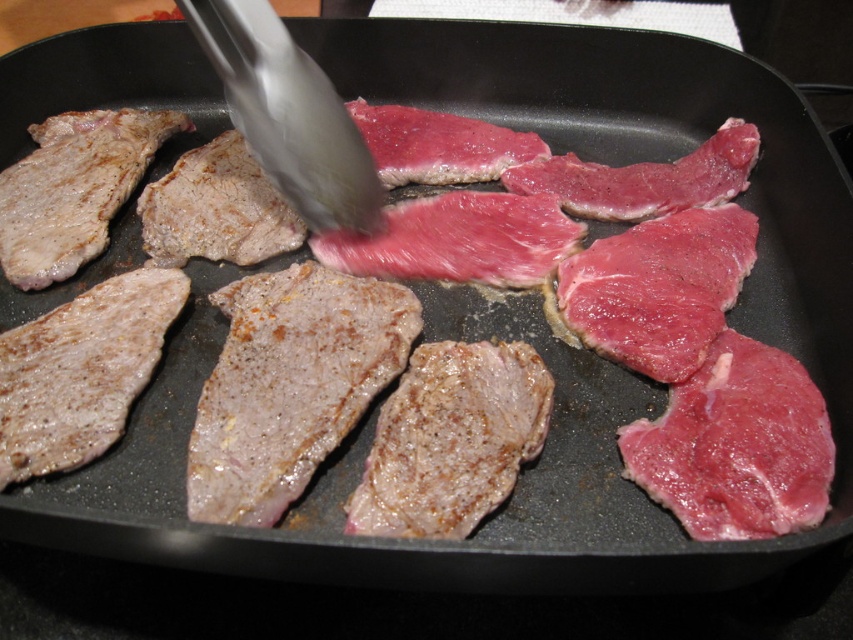
You are a chef trying to flip the pink raw meat at center with the silver metallic tong at center. Can you fit the meat into the tong?

The pink raw meat at center is smaller than the silver metallic tong at center, so the meat may not fit properly in the tong. You might need to adjust your grip or use a different tool.

You are a chef trying to flip the lamb chop closest to you in the frying pan. The two points you see are point (x=744, y=467) and point (x=238, y=33). Which point should you aim for to flip the closest lamb chop?

Point (x=744, y=467) is closer to the viewer than point (x=238, y=33), so you should aim for point (x=744, y=467) to flip the closest lamb chop.

You are a chef trying to flip the pink raw meat at center using the silver metallic tong at center. Can you reach the meat with the tongs?

The pink raw meat at center is shorter than the silver metallic tong at center, so yes, the chef can reach the pink raw meat at center with the silver metallic tong at center since the tongs are longer than the meat.